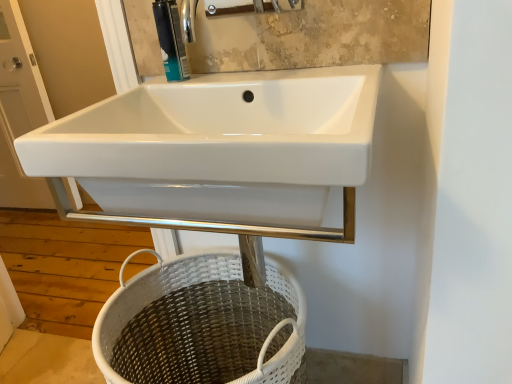
Question: Based on their positions, is white glossy sink at upper left located to the left or right of white wicker basket at lower center?

Choices:
 (A) right
 (B) left

Answer: (B)

Question: Is white glossy sink at upper left spatially inside white wicker basket at lower center, or outside of it?

Choices:
 (A) inside
 (B) outside

Answer: (B)

Question: Which of these objects is positioned closest to the white glossy sink at upper left?

Choices:
 (A) white wicker basket at lower center
 (B) matte plastic soap dispenser at upper center

Answer: (A)

Question: Which object is the farthest from the white glossy sink at upper left?

Choices:
 (A) white wicker basket at lower center
 (B) matte plastic soap dispenser at upper center

Answer: (B)